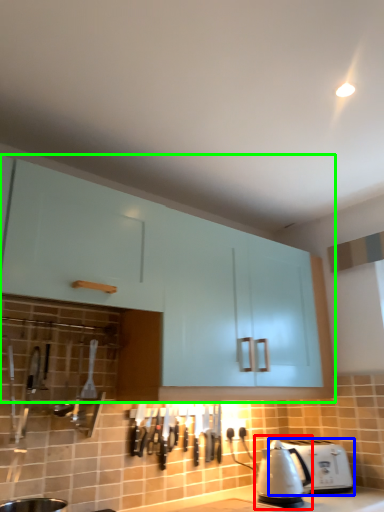
Question: Considering the real-world distances, which object is farthest from kettle (highlighted by a red box)? toaster (highlighted by a blue box) or cabinetry (highlighted by a green box)?

Choices:
 (A) toaster
 (B) cabinetry

Answer: (B)